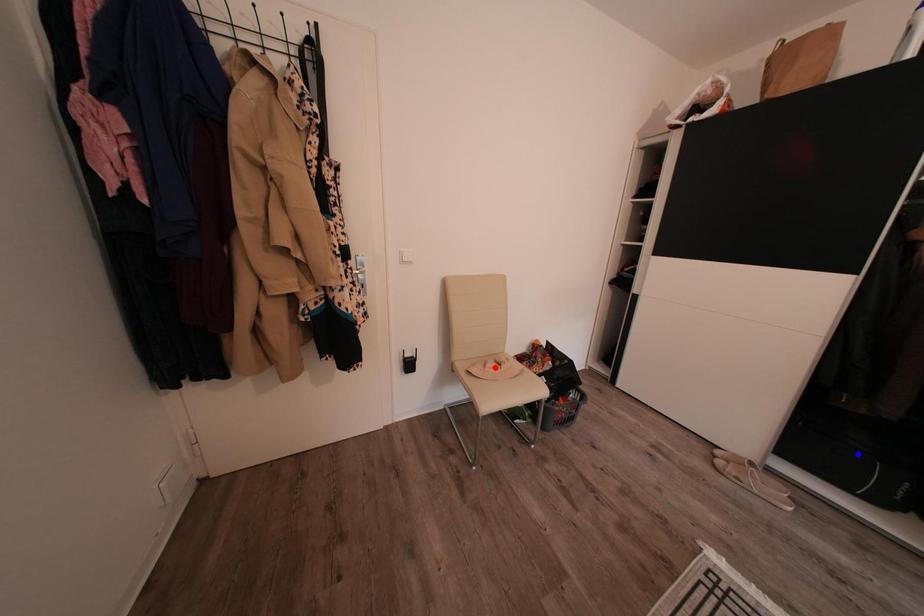
Question: Which of the two points in the image is closer to the camera?

Choices:
 (A) Blue point is closer.
 (B) Red point is closer.

Answer: (A)